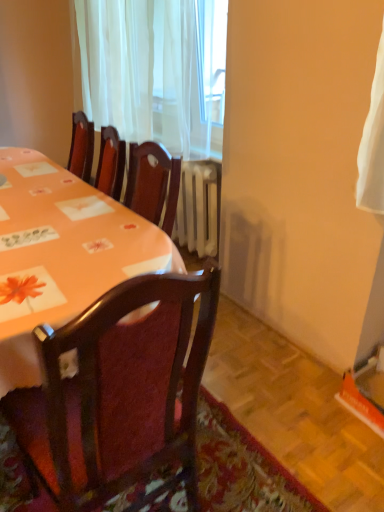
Question: Could you tell me if wooden chair at center is facing orange fabric table at upper left?

Choices:
 (A) no
 (B) yes

Answer: (B)

Question: Would you say wooden chair at center is outside orange fabric table at upper left?

Choices:
 (A) yes
 (B) no

Answer: (A)

Question: From the image's perspective, would you say wooden chair at center is positioned over orange fabric table at upper left?

Choices:
 (A) no
 (B) yes

Answer: (A)

Question: Considering the relative sizes of wooden chair at center and orange fabric table at upper left in the image provided, is wooden chair at center wider than orange fabric table at upper left?

Choices:
 (A) no
 (B) yes

Answer: (B)

Question: Is wooden chair at center placed right next to orange fabric table at upper left?

Choices:
 (A) no
 (B) yes

Answer: (A)

Question: Is wooden chair at center oriented away from orange fabric table at upper left?

Choices:
 (A) no
 (B) yes

Answer: (A)

Question: Are white sheer curtain at upper center and orange fabric table at upper left making contact?

Choices:
 (A) no
 (B) yes

Answer: (A)

Question: Is orange fabric table at upper left surrounded by white sheer curtain at upper center?

Choices:
 (A) no
 (B) yes

Answer: (A)

Question: Are white sheer curtain at upper center and orange fabric table at upper left far apart?

Choices:
 (A) no
 (B) yes

Answer: (A)

Question: From the image's perspective, is white sheer curtain at upper center under orange fabric table at upper left?

Choices:
 (A) yes
 (B) no

Answer: (B)

Question: From a real-world perspective, does white sheer curtain at upper center sit lower than orange fabric table at upper left?

Choices:
 (A) yes
 (B) no

Answer: (B)

Question: Is white sheer curtain at upper center closer to camera compared to orange fabric table at upper left?

Choices:
 (A) no
 (B) yes

Answer: (A)

Question: Is wooden chair at center a part of orange fabric table at upper left?

Choices:
 (A) yes
 (B) no

Answer: (B)